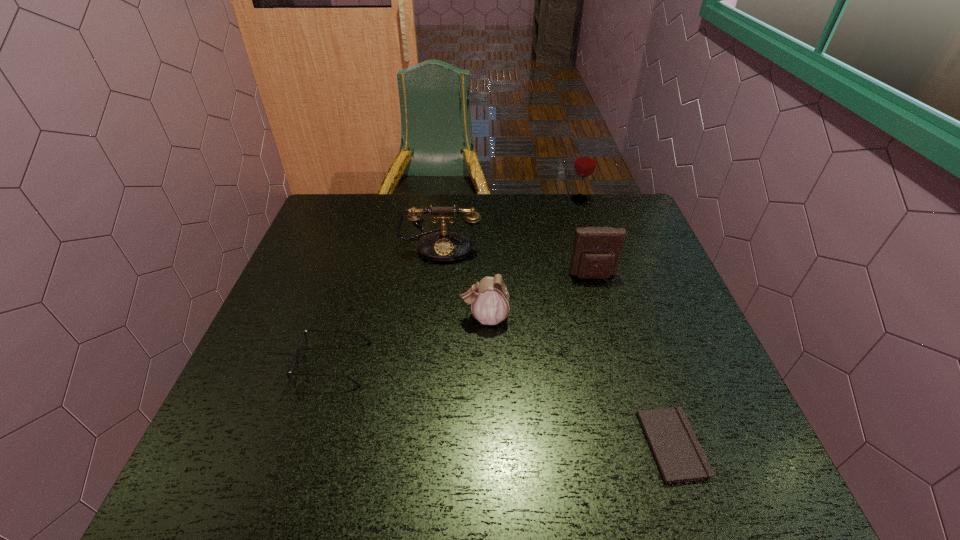
The width and height of the screenshot is (960, 540). What are the coordinates of `vacant space at the right edge of the desktop` in the screenshot? It's located at (644, 267).

Locate an element on the screen. This screenshot has width=960, height=540. free space at the far left corner of the desktop is located at coordinates (332, 204).

Where is `vacant region between the spectacles and the checkbook`? This screenshot has height=540, width=960. vacant region between the spectacles and the checkbook is located at coordinates (503, 404).

Where is `free space between the farthest object and the left pouch`? free space between the farthest object and the left pouch is located at coordinates (532, 258).

The width and height of the screenshot is (960, 540). I want to click on empty space that is in between the fourth farthest object and the second nearest object, so click(x=409, y=341).

This screenshot has height=540, width=960. What are the coordinates of `free spot between the left pouch and the right pouch` in the screenshot? It's located at click(539, 297).

The width and height of the screenshot is (960, 540). I want to click on vacant space in between the right pouch and the telephone, so click(x=516, y=261).

The height and width of the screenshot is (540, 960). Identify the location of free space that is in between the spectacles and the shortest object. (503, 404).

The image size is (960, 540). What are the coordinates of `free spot between the nearer pouch and the tallest object` in the screenshot? It's located at (532, 258).

Locate an element on the screen. The height and width of the screenshot is (540, 960). vacant space that's between the checkbook and the nearer pouch is located at coordinates (578, 381).